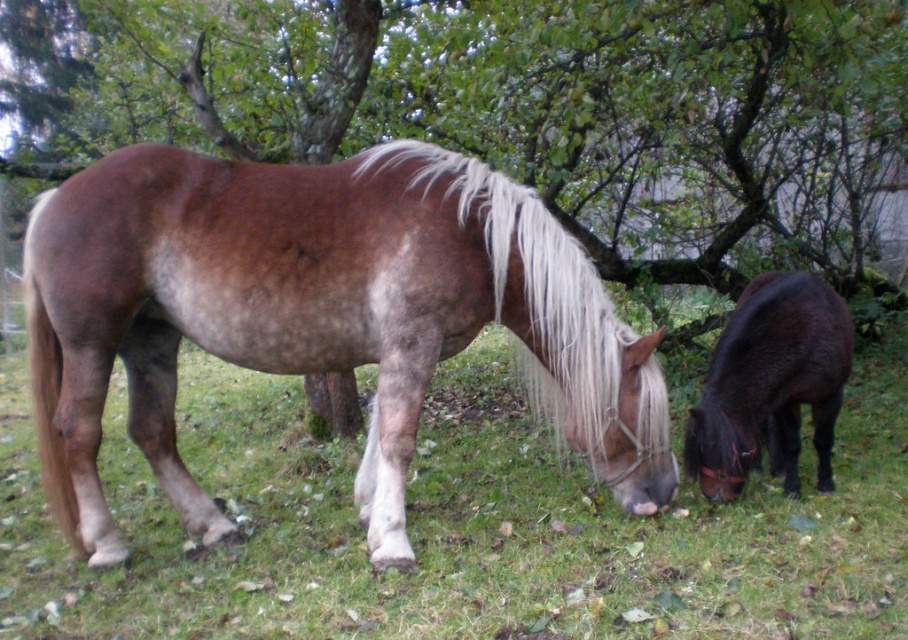
You are a farmer checking the field. You see the green grass at center and the brown matte horse at center. Which one is wider?

The green grass at center is wider than the brown matte horse at center.

You are a farmer checking the field where two horses are grazing. You notice the green leafy tree at upper center and the green grass at center. Which of these two has a smaller width?

The green leafy tree at upper center has a lesser width compared to the green grass at center, so the green leafy tree at upper center is the one with the smaller width.